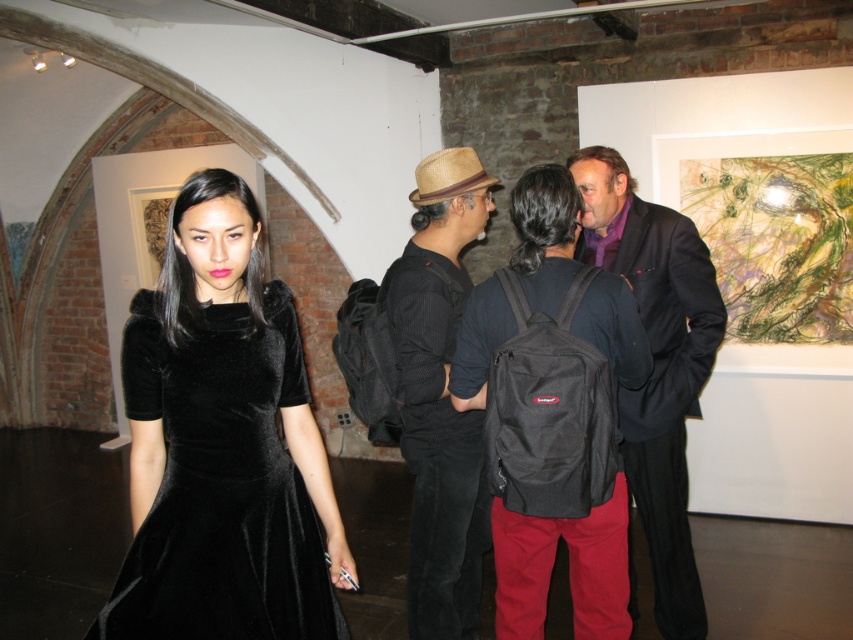
Question: Is straw hat at center to the right of dark suit at center from the viewer's perspective?

Choices:
 (A) yes
 (B) no

Answer: (B)

Question: Which object is closer to the camera taking this photo?

Choices:
 (A) straw hat at center
 (B) velvet black dress at left
 (C) black velvet dress at center

Answer: (B)

Question: Among these points, which one is farthest from the camera?

Choices:
 (A) (618, 401)
 (B) (141, 378)
 (C) (408, 426)
 (D) (558, 365)

Answer: (C)

Question: Estimate the real-world distances between objects in this image. Which object is closer to the velvet black dress at left?

Choices:
 (A) straw hat at center
 (B) black velvet dress at center

Answer: (B)

Question: Can you confirm if black velvet dress at center is wider than dark suit at center?

Choices:
 (A) no
 (B) yes

Answer: (B)

Question: Does black velvet dress at center appear over straw hat at center?

Choices:
 (A) yes
 (B) no

Answer: (A)